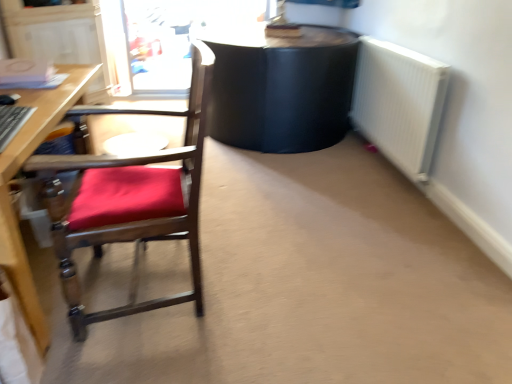
Question: Considering the relative positions of transparent plastic screen door at upper left and wooden chair with red cushion at left in the image provided, is transparent plastic screen door at upper left to the left or to the right of wooden chair with red cushion at left?

Choices:
 (A) left
 (B) right

Answer: (A)

Question: Is transparent plastic screen door at upper left inside or outside of wooden chair with red cushion at left?

Choices:
 (A) outside
 (B) inside

Answer: (A)

Question: Based on their relative distances, which object is farther from the wooden chair with red cushion at left?

Choices:
 (A) transparent plastic screen door at upper left
 (B) white metallic radiator at right

Answer: (A)

Question: Which is farther from the transparent plastic screen door at upper left?

Choices:
 (A) white metallic radiator at right
 (B) wooden chair with red cushion at left

Answer: (B)